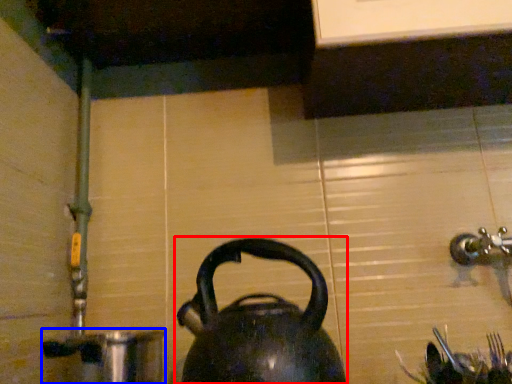
Question: Which of the following is the farthest to the observer, kettle (highlighted by a red box) or coffeepot (highlighted by a blue box)?

Choices:
 (A) kettle
 (B) coffeepot

Answer: (B)